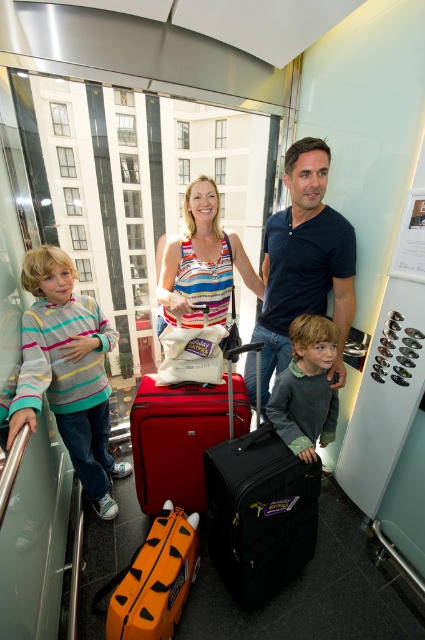
Does dark blue t-shirt at center have a greater height compared to matte red suitcase at center?

Indeed, dark blue t-shirt at center has a greater height compared to matte red suitcase at center.

Between dark blue t-shirt at center and matte red suitcase at center, which one has less height?

matte red suitcase at center is shorter.

Is point (337, 266) in front of point (201, 497)?

Yes, it is.

Where is `dark blue t-shirt at center`? dark blue t-shirt at center is located at coordinates (305, 262).

Is dark blue t-shirt at center shorter than striped fabric tank top at center?

No.

Looking at this image, between dark blue t-shirt at center and striped fabric tank top at center, which one appears on the left side from the viewer's perspective?

striped fabric tank top at center is more to the left.

The height and width of the screenshot is (640, 425). In order to click on dark blue t-shirt at center in this screenshot , I will do `click(305, 262)`.

Does matte black suitcase at center have a larger size compared to black matte suitcase at center?

Indeed, matte black suitcase at center has a larger size compared to black matte suitcase at center.

Consider the image. Is matte black suitcase at center taller than black matte suitcase at center?

Yes, matte black suitcase at center is taller than black matte suitcase at center.

Who is more forward, (286, 225) or (252, 522)?

Point (252, 522)

Identify the location of matte black suitcase at center. The width and height of the screenshot is (425, 640). (302, 264).